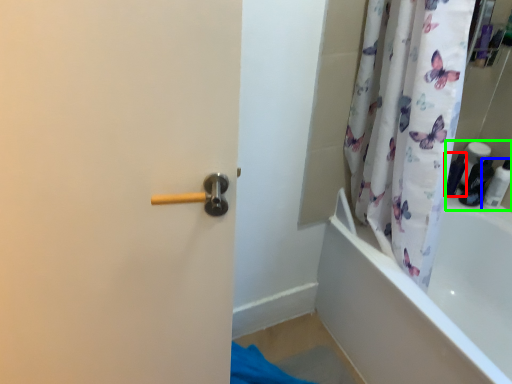
Question: Which is farther away from toiletry (highlighted by a red box)? toiletry (highlighted by a blue box) or toiletry (highlighted by a green box)?

Choices:
 (A) toiletry
 (B) toiletry

Answer: (A)